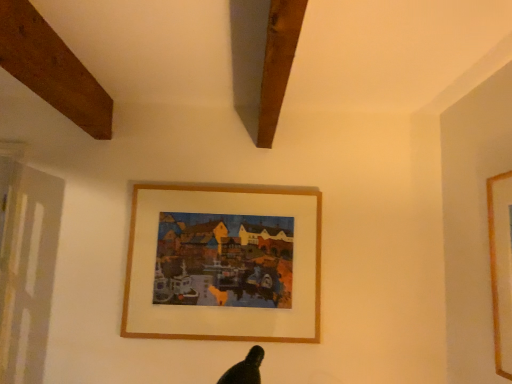
Measure the distance between point (213, 322) and camera.

They are 6.41 feet apart.

Describe the element at coordinates (224, 263) in the screenshot. I see `wooden frame at center` at that location.

At what (x,y) coordinates should I click in order to perform the action: click on wooden frame at center. Please return your answer as a coordinate pair (x, y). The width and height of the screenshot is (512, 384). Looking at the image, I should click on (224, 263).

The height and width of the screenshot is (384, 512). I want to click on wooden frame at center, so click(x=224, y=263).